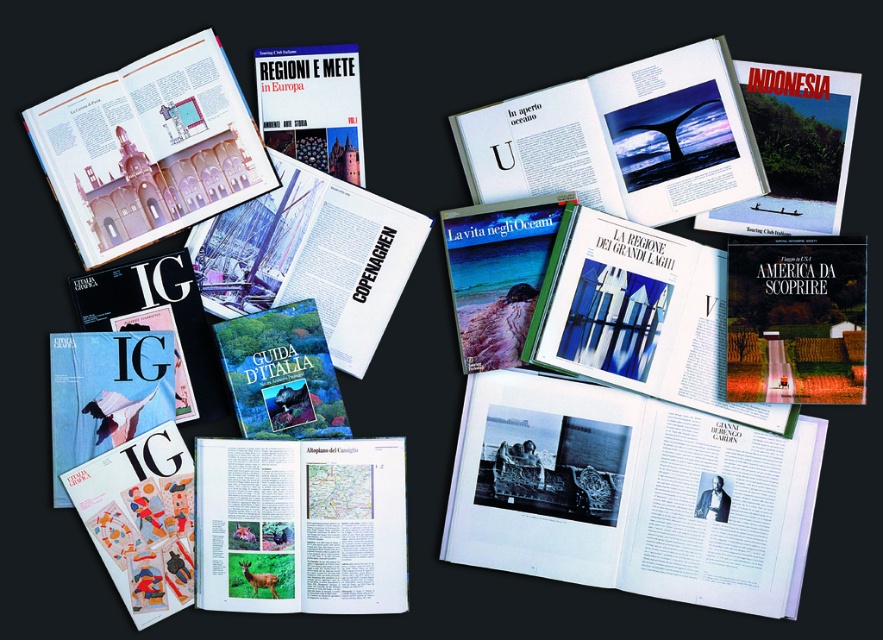
You are a researcher trying to organize these materials. You notice two points marked on the image. Which point is closer to you, point (x=495, y=419) or point (x=141, y=113)?

Point (x=141, y=113) is closer to you because the description states that point (x=495, y=419) is behind it.

You are an artist looking to sketch the scene. You notice the matte blue whale tail at upper center and the matte pink building at upper left. Which object should you draw first if you want to start with the taller one?

The matte pink building at upper left is taller than the matte blue whale tail at upper center, so you should draw the matte pink building at upper left first.